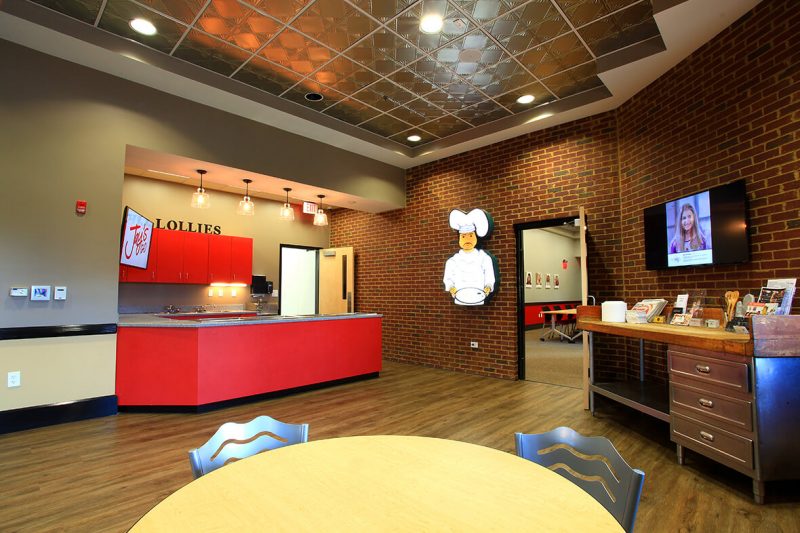
Locate an element on the screen. metal chair backs is located at coordinates (614, 478), (258, 433).